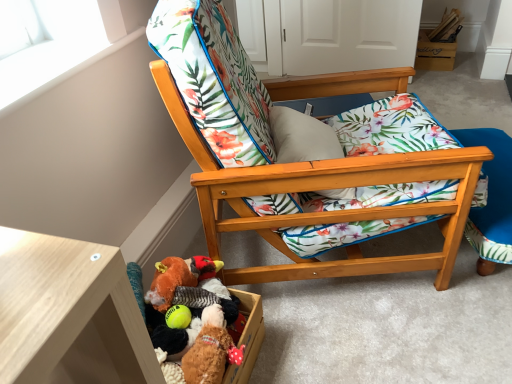
The height and width of the screenshot is (384, 512). Identify the location of wooden box at upper right. (434, 53).

What do you see at coordinates (208, 349) in the screenshot?
I see `fluffy brown teddy bear at lower center, the 2th toy from the back` at bounding box center [208, 349].

Locate an element on the screen. This screenshot has height=384, width=512. white matte window screen at upper left is located at coordinates click(47, 43).

Describe the element at coordinates (490, 200) in the screenshot. This screenshot has width=512, height=384. I see `wooden folding chair at lower right` at that location.

The width and height of the screenshot is (512, 384). What are the coordinates of `wooden folding chair at lower right` in the screenshot? It's located at (490, 200).

Where is `wooden box at upper right`? This screenshot has height=384, width=512. wooden box at upper right is located at coordinates (434, 53).

Is white matte window screen at upper left completely or partially outside of wooden box at upper right?

white matte window screen at upper left is positioned outside wooden box at upper right.

Is white matte window screen at upper left with wooden box at upper right?

white matte window screen at upper left and wooden box at upper right are not in contact.

In the scene shown: Is white matte window screen at upper left at the left side of wooden box at upper right?

Yes, white matte window screen at upper left is to the left of wooden box at upper right.

Is point (211, 290) in front of point (509, 215)?

Yes, it is.

Is fluffy fabric stuffed animal at lower left, positioned as the first toy in back-to-front order, not close to wooden folding chair at lower right?

They are positioned close to each other.

Choose the correct answer: Is fluffy fabric stuffed animal at lower left, positioned as the first toy in back-to-front order, inside wooden folding chair at lower right or outside it?

fluffy fabric stuffed animal at lower left, positioned as the first toy in back-to-front order, lies outside wooden folding chair at lower right.

In the scene shown: From a real-world perspective, is fluffy fabric stuffed animal at lower left, positioned as the first toy in back-to-front order, positioned above or below wooden folding chair at lower right?

Clearly, from a real-world perspective, fluffy fabric stuffed animal at lower left, positioned as the first toy in back-to-front order, is above wooden folding chair at lower right.

From their relative heights in the image, would you say wooden box at upper right is taller or shorter than fluffy brown teddy bear at lower center, the 1th toy viewed from the front?

Clearly, wooden box at upper right is taller compared to fluffy brown teddy bear at lower center, the 1th toy viewed from the front.

Does point (420, 64) come behind point (209, 327)?

Yes, point (420, 64) is farther from viewer.

Based on their positions, is wooden box at upper right located to the left or right of fluffy brown teddy bear at lower center, the 1th toy viewed from the front?

In the image, wooden box at upper right appears on the right side of fluffy brown teddy bear at lower center, the 1th toy viewed from the front.

From a real-world perspective, is wooden box at upper right physically above fluffy brown teddy bear at lower center, the 2th toy from the back?

No.

Is fluffy brown teddy bear at lower center, the 2th toy from the back, bigger or smaller than wooden folding chair at lower right?

fluffy brown teddy bear at lower center, the 2th toy from the back, is smaller than wooden folding chair at lower right.

Relative to wooden folding chair at lower right, is fluffy brown teddy bear at lower center, the 1th toy viewed from the front, in front or behind?

In the image, fluffy brown teddy bear at lower center, the 1th toy viewed from the front, appears in front of wooden folding chair at lower right.

Choose the correct answer: Is fluffy brown teddy bear at lower center, the 2th toy from the back, inside wooden folding chair at lower right or outside it?

fluffy brown teddy bear at lower center, the 2th toy from the back, is outside wooden folding chair at lower right.

How many degrees apart are the facing directions of fluffy brown teddy bear at lower center, the 2th toy from the back, and wooden folding chair at lower right?

The angle between the facing direction of fluffy brown teddy bear at lower center, the 2th toy from the back, and the facing direction of wooden folding chair at lower right is 20 degrees.

From a real-world perspective, is white matte window screen at upper left physically located above or below wooden folding chair at lower right?

From a real-world perspective, white matte window screen at upper left is physically above wooden folding chair at lower right.

Considering the sizes of white matte window screen at upper left and wooden folding chair at lower right in the image, is white matte window screen at upper left wider or thinner than wooden folding chair at lower right?

In the image, white matte window screen at upper left appears to be more narrow than wooden folding chair at lower right.

Is white matte window screen at upper left positioned beyond the bounds of wooden folding chair at lower right?

That's correct, white matte window screen at upper left is outside of wooden folding chair at lower right.

Looking at this image, between white matte window screen at upper left and wooden folding chair at lower right, which one has larger size?

With larger size is wooden folding chair at lower right.

From the image's perspective, would you say wooden folding chair at lower right is positioned over fluffy fabric stuffed animal at lower left, the 2th toy viewed from the front?

Yes, from the image's perspective, wooden folding chair at lower right is over fluffy fabric stuffed animal at lower left, the 2th toy viewed from the front.

Considering the relative positions of wooden folding chair at lower right and fluffy fabric stuffed animal at lower left, positioned as the first toy in back-to-front order, in the image provided, is wooden folding chair at lower right in front of fluffy fabric stuffed animal at lower left, positioned as the first toy in back-to-front order,?

That is False.

Find the location of `toy that is the 1st one above the wooden folding chair at lower right (from a real-world perspective)`. toy that is the 1st one above the wooden folding chair at lower right (from a real-world perspective) is located at coordinates (214, 284).

Does point (497, 192) lie behind point (218, 292)?

Yes, it is.

From a real-world perspective, is fluffy brown teddy bear at lower center, the 2th toy from the back, above or below white matte window screen at upper left?

Clearly, from a real-world perspective, fluffy brown teddy bear at lower center, the 2th toy from the back, is below white matte window screen at upper left.

Based on their positions, is fluffy brown teddy bear at lower center, the 1th toy viewed from the front, located to the left or right of white matte window screen at upper left?

Clearly, fluffy brown teddy bear at lower center, the 1th toy viewed from the front, is on the right of white matte window screen at upper left in the image.

Considering the sizes of objects fluffy brown teddy bear at lower center, the 1th toy viewed from the front, and white matte window screen at upper left in the image provided, who is shorter, fluffy brown teddy bear at lower center, the 1th toy viewed from the front, or white matte window screen at upper left?

With less height is white matte window screen at upper left.

Is fluffy brown teddy bear at lower center, the 2th toy from the back, aimed at white matte window screen at upper left?

No, fluffy brown teddy bear at lower center, the 2th toy from the back, is not facing towards white matte window screen at upper left.

You are a GUI agent. You are given a task and a screenshot of the screen. Output one action in this format:
    pyautogui.click(x=<x>, y=<y>)
    Task: Click on the storage box below the white matte window screen at upper left (from a real-world perspective)
    The width and height of the screenshot is (512, 384).
    Given the screenshot: What is the action you would take?
    pyautogui.click(x=434, y=53)

From the image's perspective, count 1st toys downward from the wooden folding chair at lower right and point to it. Please provide its 2D coordinates.

[(214, 284)]

Estimate the real-world distances between objects in this image. Which object is further from wooden box at upper right, wooden chair with floral cushion at center or fluffy brown teddy bear at lower center, the 2th toy from the back?

fluffy brown teddy bear at lower center, the 2th toy from the back, is further to wooden box at upper right.

Estimate the real-world distances between objects in this image. Which object is further from wooden chair with floral cushion at center, wooden folding chair at lower right or wooden box at upper right?

Among the two, wooden box at upper right is located further to wooden chair with floral cushion at center.

Based on their spatial positions, is wooden folding chair at lower right or wooden box at upper right further from fluffy fabric stuffed animal at lower left, positioned as the first toy in back-to-front order?

wooden box at upper right.

Consider the image. Looking at the image, which one is located closer to white matte window screen at upper left, wooden box at upper right or wooden chair with floral cushion at center?

wooden chair with floral cushion at center lies closer to white matte window screen at upper left than the other object.

Estimate the real-world distances between objects in this image. Which object is closer to fluffy fabric stuffed animal at lower left, the 2th toy viewed from the front, fluffy brown teddy bear at lower center, the 1th toy viewed from the front, or wooden box at upper right?

fluffy brown teddy bear at lower center, the 1th toy viewed from the front.

From the image, which object appears to be farther from wooden chair with floral cushion at center, white matte window screen at upper left or wooden folding chair at lower right?

white matte window screen at upper left lies further to wooden chair with floral cushion at center than the other object.

Estimate the real-world distances between objects in this image. Which object is further from fluffy fabric stuffed animal at lower left, the 2th toy viewed from the front, wooden box at upper right or wooden folding chair at lower right?

wooden box at upper right.

Estimate the real-world distances between objects in this image. Which object is further from wooden chair with floral cushion at center, fluffy fabric stuffed animal at lower left, positioned as the first toy in back-to-front order, or wooden box at upper right?

wooden box at upper right is further to wooden chair with floral cushion at center.

I want to click on toy between white matte window screen at upper left and fluffy brown teddy bear at lower center, the 2th toy from the back, in the vertical direction, so click(214, 284).

Image resolution: width=512 pixels, height=384 pixels. In order to click on folding chair positioned between fluffy brown teddy bear at lower center, the 2th toy from the back, and wooden box at upper right from near to far in this screenshot , I will do `click(490, 200)`.

This screenshot has height=384, width=512. Identify the location of chair situated between white matte window screen at upper left and wooden folding chair at lower right from left to right. tap(307, 180).

Image resolution: width=512 pixels, height=384 pixels. Find the location of `window screen located between wooden chair with floral cushion at center and wooden box at upper right in the depth direction`. window screen located between wooden chair with floral cushion at center and wooden box at upper right in the depth direction is located at coordinates (47, 43).